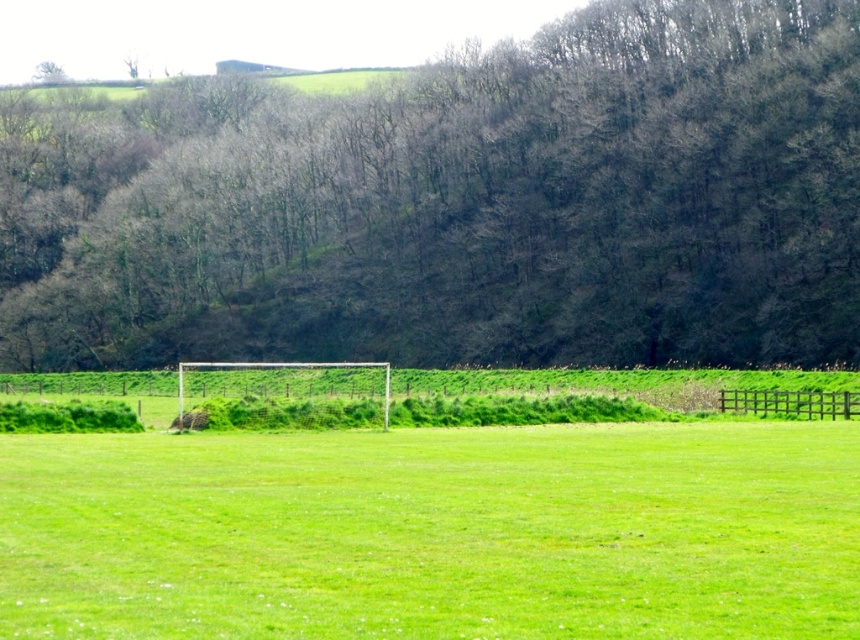
You are a landscape photographer planning to capture a photo of the brown leafless trees at center and the green leafy tree at upper left. Based on their sizes, which tree would appear more dominant in the composition?

The brown leafless trees at center would appear more dominant in the composition because their width is larger than the green leafy tree at upper left.